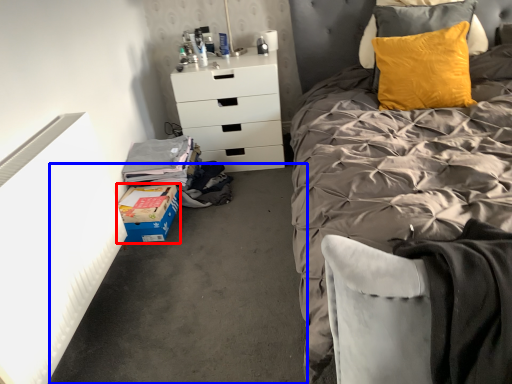
Question: Which point is further to the camera, cardboard box (highlighted by a red box) or concrete (highlighted by a blue box)?

Choices:
 (A) cardboard box
 (B) concrete

Answer: (A)